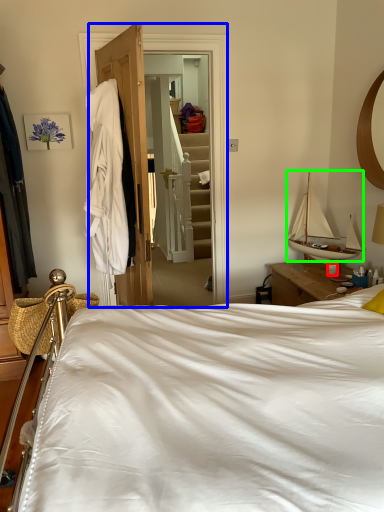
Question: Based on their relative distances, which object is nearer to coffee cup (highlighted by a red box)? Choose from closet (highlighted by a blue box) and boat (highlighted by a green box).

Choices:
 (A) closet
 (B) boat

Answer: (B)